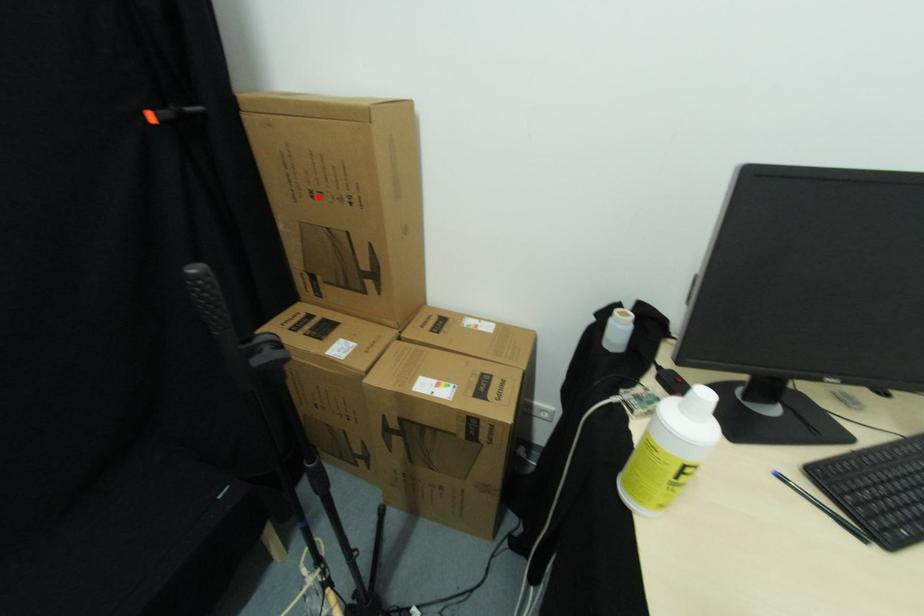
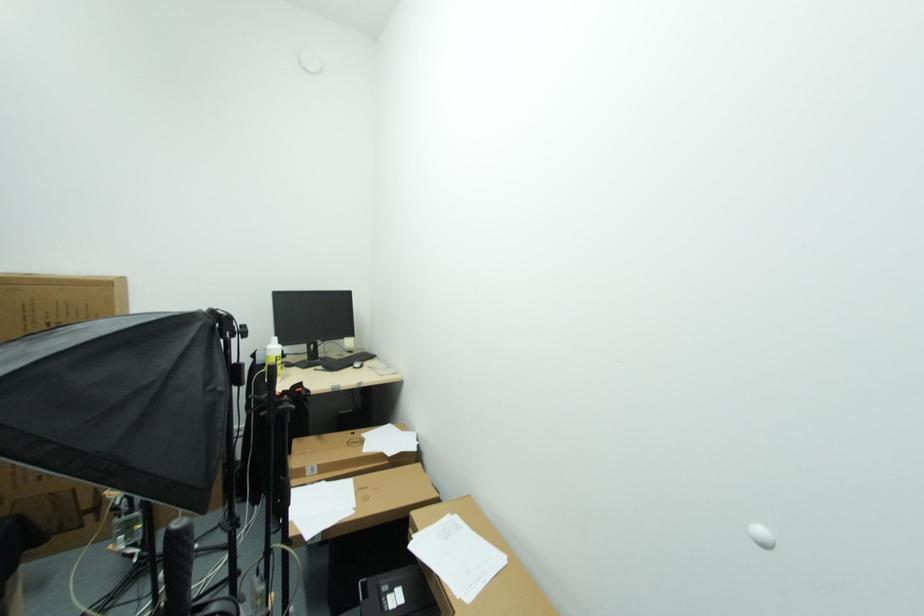
Question: I am providing you with two images of the same scene from different viewpoints. Given a red point in image1, look at the same physical point in image2. Is it:

Choices:
 (A) Closer to the viewpoint
 (B) Farther from the viewpoint

Answer: (B)